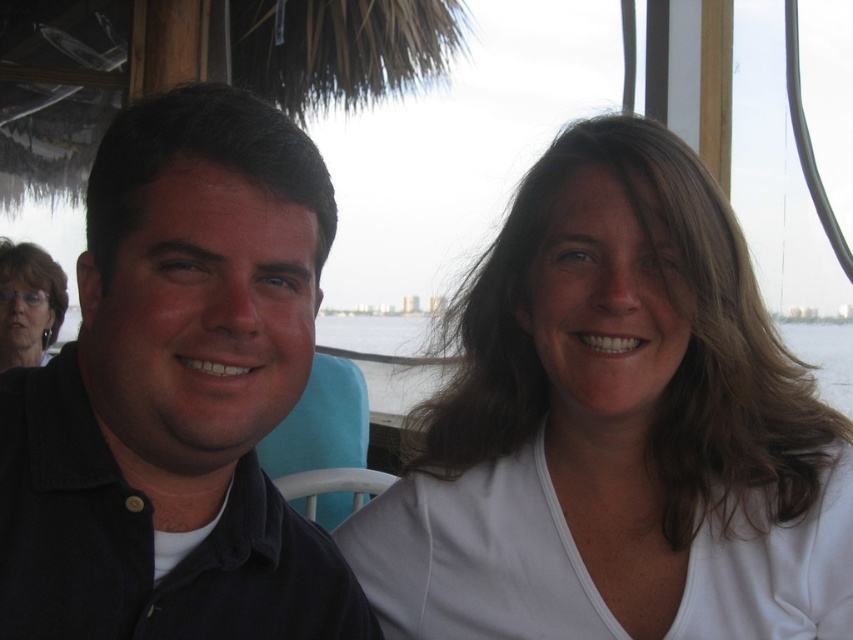
Question: Does black matte shirt at left appear under matte black hair at upper left?

Choices:
 (A) no
 (B) yes

Answer: (B)

Question: Which object is closer to the camera taking this photo?

Choices:
 (A) matte black hair at upper left
 (B) white matte shirt at center
 (C) black matte shirt at left

Answer: (C)

Question: From the image, what is the correct spatial relationship of black matte shirt at left in relation to clear water at upper center?

Choices:
 (A) right
 (B) left

Answer: (B)

Question: Is white matte shirt at center positioned behind black matte shirt at left?

Choices:
 (A) yes
 (B) no

Answer: (A)

Question: Which point appears farthest from the camera in this image?

Choices:
 (A) (409, 625)
 (B) (64, 285)

Answer: (B)

Question: Among these points, which one is nearest to the camera?

Choices:
 (A) (734, 378)
 (B) (50, 285)
 (C) (422, 323)

Answer: (A)